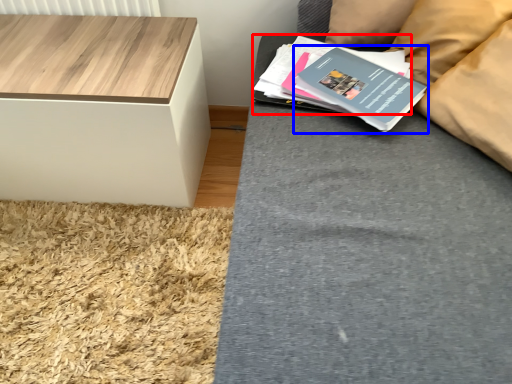
Question: Which of the following is the closest to the observer, paperback book (highlighted by a red box) or paperback book (highlighted by a blue box)?

Choices:
 (A) paperback book
 (B) paperback book

Answer: (B)